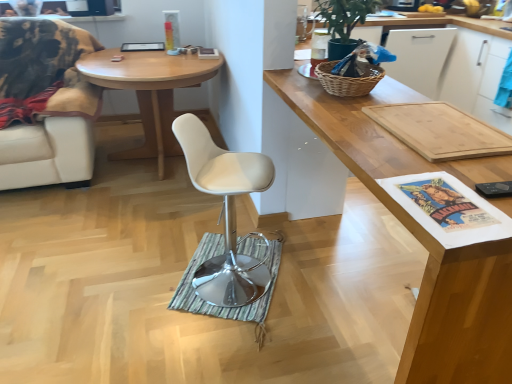
Question: In the image, is light wood desk at center positioned in front of or behind white leather chair at left?

Choices:
 (A) front
 (B) behind

Answer: (B)

Question: Considering the positions of light wood desk at center and white leather chair at left in the image, is light wood desk at center wider or thinner than white leather chair at left?

Choices:
 (A) wide
 (B) thin

Answer: (A)

Question: Considering the real-world distances, which object is closest to the woven wicker picnic basket at upper right?

Choices:
 (A) white leather swivel chair at center
 (B) wooden cutting board at upper right
 (C) light wood desk at center
 (D) white leather chair at left
 (E) green striped mat at center

Answer: (B)

Question: Which object is positioned farthest from the white leather chair at left?

Choices:
 (A) green striped mat at center
 (B) wooden cutting board at upper right
 (C) woven wicker picnic basket at upper right
 (D) white leather swivel chair at center
 (E) light wood desk at center

Answer: (C)